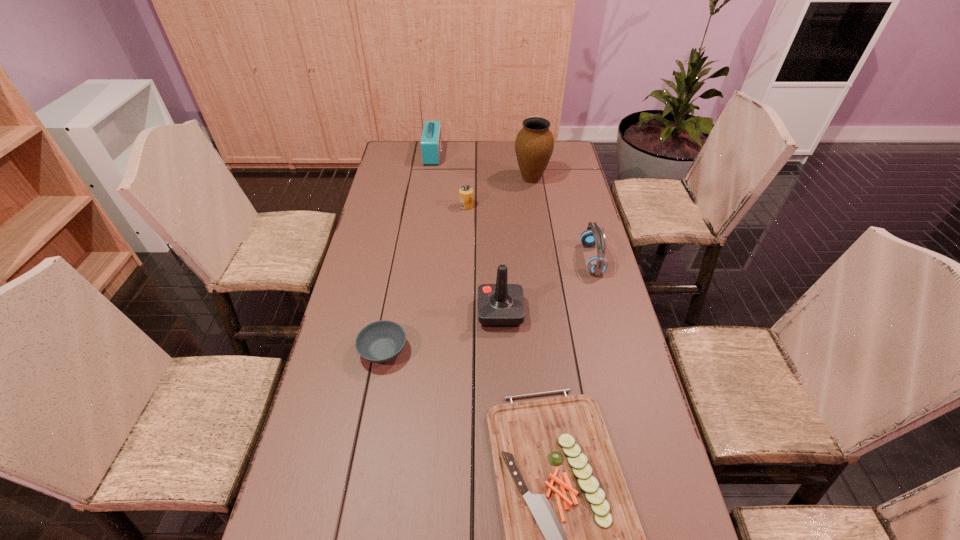
At what (x,y) coordinates should I click in order to perform the action: click on vacant space that is in between the second tallest object and the sixth tallest object. Please return your answer as a coordinate pair (x, y). The height and width of the screenshot is (540, 960). Looking at the image, I should click on (457, 265).

This screenshot has width=960, height=540. I want to click on empty space that is in between the radio receiver and the fifth tallest object, so click(x=449, y=180).

Where is `object that stands as the fifth closest to the urn`? object that stands as the fifth closest to the urn is located at coordinates (381, 341).

Locate which object is the closest to the headset. Please provide its 2D coordinates. Your answer should be formatted as a tuple, i.e. [(x, y)], where the tuple contains the x and y coordinates of a point satisfying the conditions above.

[(499, 305)]

Locate an element on the screen. Image resolution: width=960 pixels, height=540 pixels. vacant space that satisfies the following two spatial constraints: 1. on the back side of the fifth nearest object; 2. on the left side of the second shortest object is located at coordinates (411, 206).